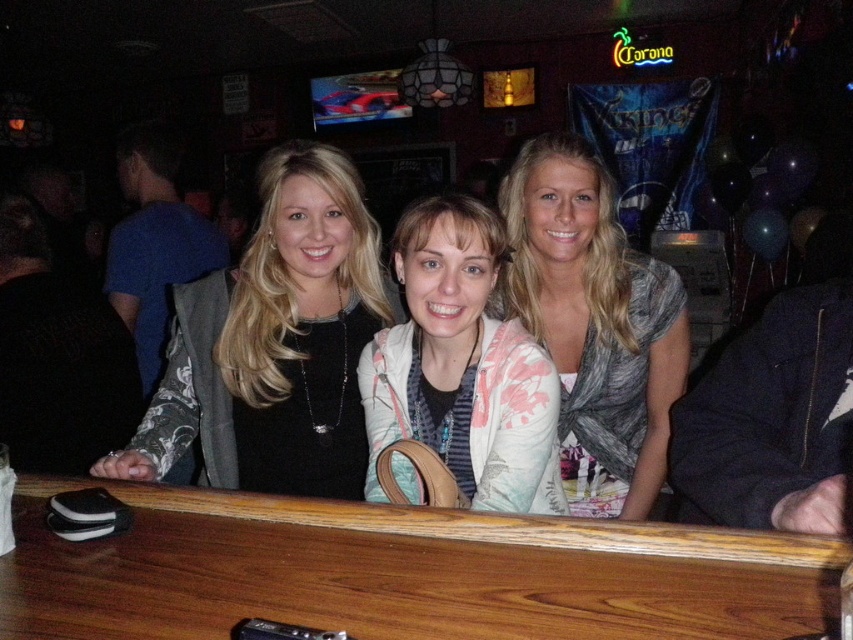
You are a server in a bar and need to place a 12 inch wide plate on the wooden table at center. The gray textured scarf at center is currently on the table. Can you place the plate on the table without moving the scarf?

The wooden table at center and gray textured scarf at center are 29.25 inches apart from each other. Since the plate is only 12 inches wide, there is enough space on the table to place the plate without moving the scarf.

You are a photographer standing in front of the wooden table at center and the gray textured scarf at center. You want to take a photo of the scarf without the table appearing in the frame. Which object should you move closer to the camera?

The gray textured scarf at center is located above the wooden table at center. To take a photo of the scarf without the table in the frame, you should move closer to the gray textured scarf at center so it fills the frame while the table remains out of view.

You are a photographer trying to capture a closeup of both the gray textured scarf at center and the pink floral cardigan at center. Based on their sizes, which one do you need to move closer to the camera to ensure it fills the frame properly?

The gray textured scarf at center is much taller than the pink floral cardigan at center, so you should move the gray textured scarf at center closer to the camera to ensure it fills the frame properly.